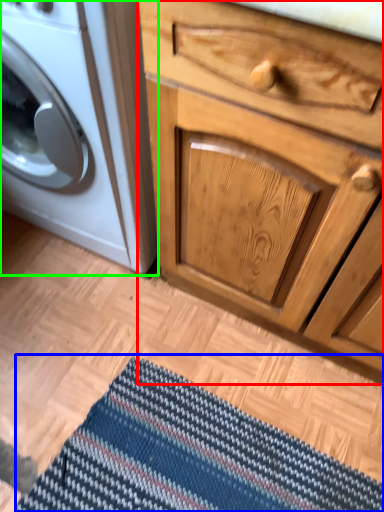
Question: Which object is the farthest from chest of drawers (highlighted by a red box)? Choose among these: doormat (highlighted by a blue box) or washing machine (highlighted by a green box).

Choices:
 (A) doormat
 (B) washing machine

Answer: (A)